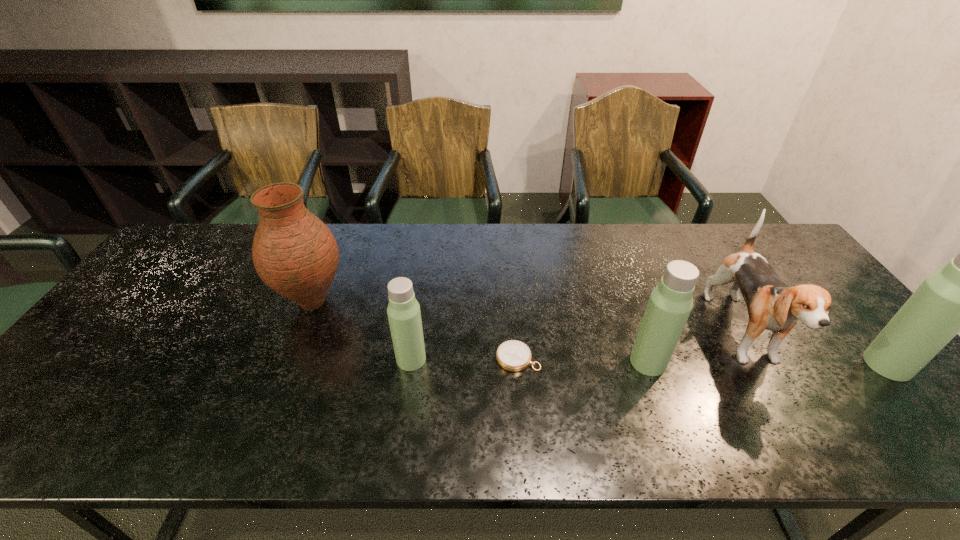
Please point a free position for a thermos bottle on the left. Please provide its 2D coordinates. Your answer should be formatted as a tuple, i.e. [(x, y)], where the tuple contains the x and y coordinates of a point satisfying the conditions above.

[(177, 357)]